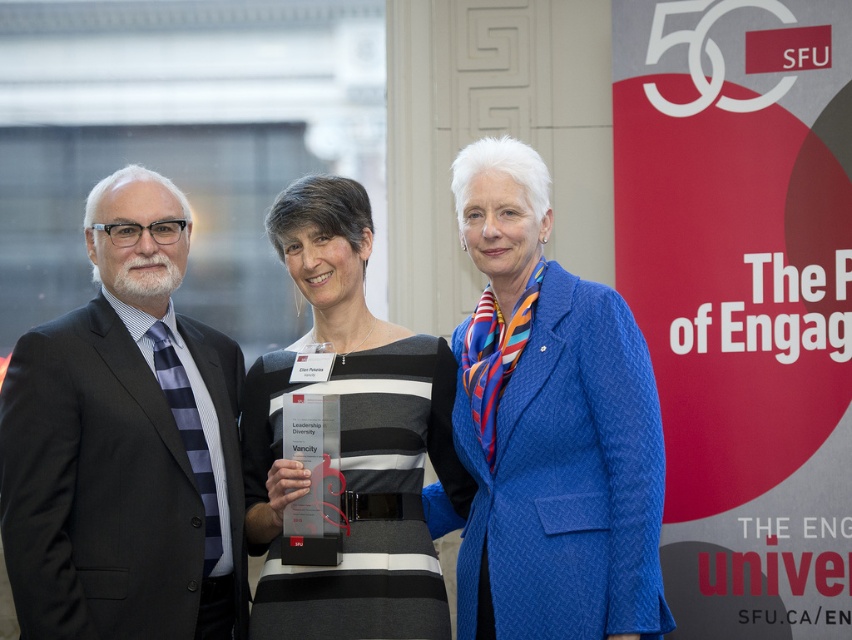
Question: Does blue textured blazer at center have a smaller size compared to striped fabric dress at center?

Choices:
 (A) yes
 (B) no

Answer: (B)

Question: Among these objects, which one is farthest from the camera?

Choices:
 (A) blue textured blazer at center
 (B) black suit at left

Answer: (A)

Question: Is black suit at left to the right of striped fabric dress at center from the viewer's perspective?

Choices:
 (A) yes
 (B) no

Answer: (B)

Question: Is black suit at left bigger than striped fabric dress at center?

Choices:
 (A) no
 (B) yes

Answer: (B)

Question: Among these objects, which one is nearest to the camera?

Choices:
 (A) black suit at left
 (B) striped fabric dress at center
 (C) blue textured blazer at center

Answer: (A)

Question: Which point is closer to the camera?

Choices:
 (A) striped fabric dress at center
 (B) black suit at left

Answer: (B)